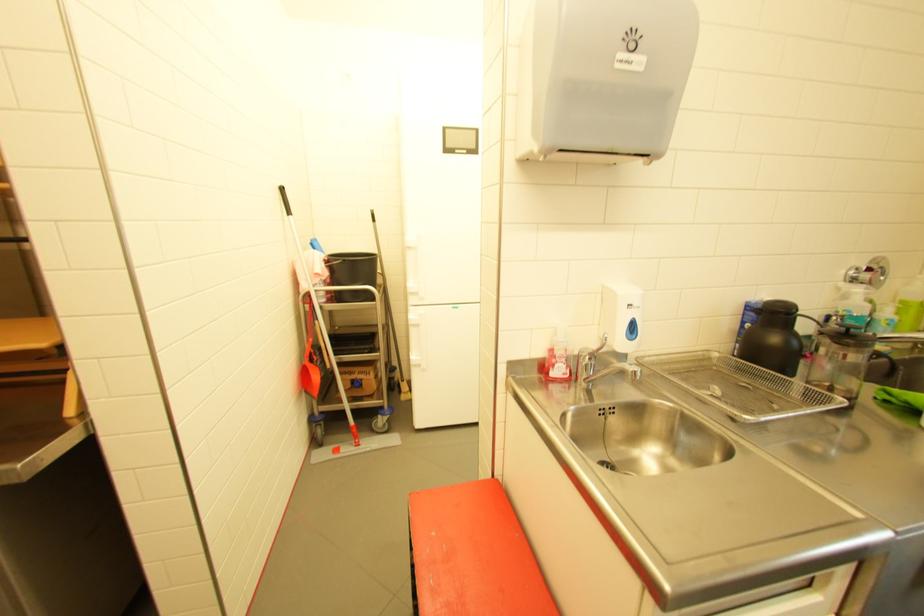
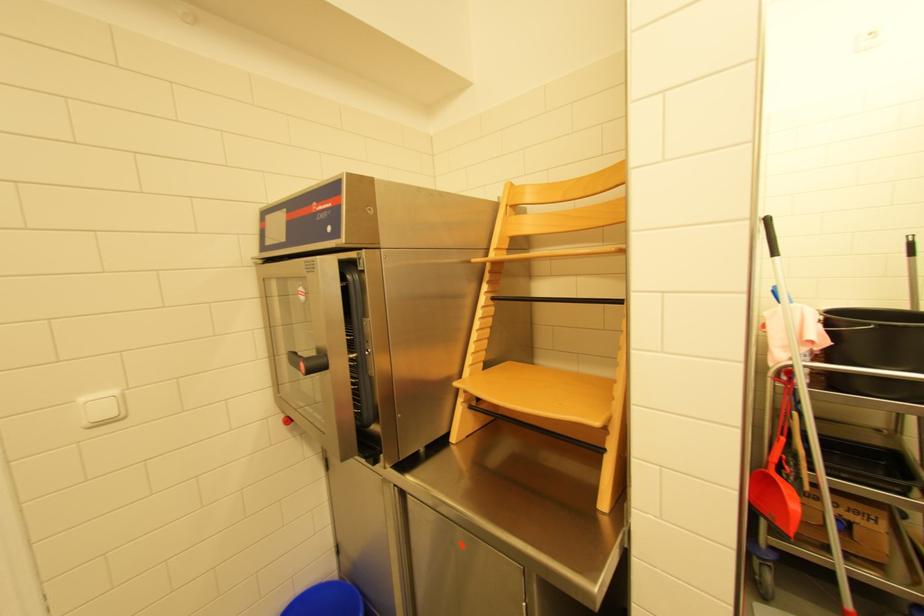
In the second image, find the point that corresponds to (351,260) in the first image.

(890, 326)